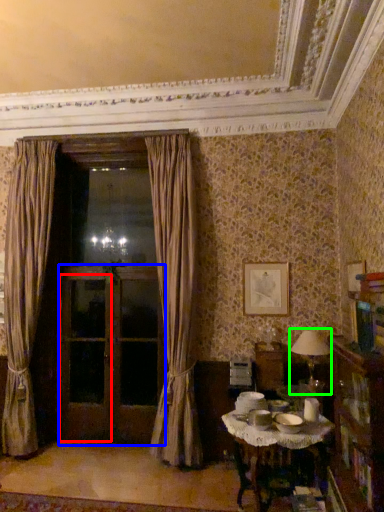
Question: Which object is the farthest from screen door (highlighted by a red box)? Choose among these: screen door (highlighted by a blue box) or table lamp (highlighted by a green box).

Choices:
 (A) screen door
 (B) table lamp

Answer: (B)